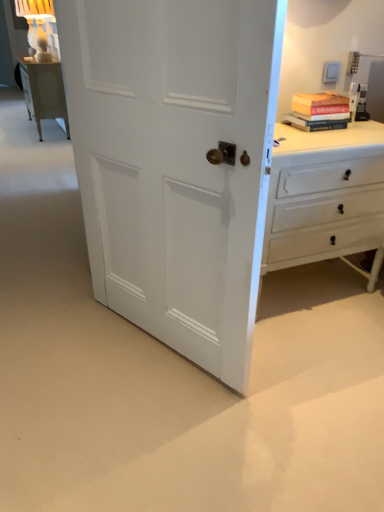
Question: From a real-world perspective, is hardcover book at upper right under white painted wood chest of drawers at right?

Choices:
 (A) yes
 (B) no

Answer: (B)

Question: Is hardcover book at upper right to the right of white painted wood chest of drawers at right from the viewer's perspective?

Choices:
 (A) no
 (B) yes

Answer: (B)

Question: Are hardcover book at upper right and white painted wood chest of drawers at right far apart?

Choices:
 (A) no
 (B) yes

Answer: (A)

Question: From the image's perspective, would you say hardcover book at upper right is shown under white painted wood chest of drawers at right?

Choices:
 (A) no
 (B) yes

Answer: (A)

Question: Are hardcover book at upper right and white painted wood chest of drawers at right making contact?

Choices:
 (A) no
 (B) yes

Answer: (A)

Question: Is hardcover book at upper right facing away from white painted wood chest of drawers at right?

Choices:
 (A) yes
 (B) no

Answer: (B)

Question: Does white painted wood door at center have a greater width compared to hardcover book at upper right?

Choices:
 (A) yes
 (B) no

Answer: (B)

Question: Can you confirm if white painted wood door at center is taller than hardcover book at upper right?

Choices:
 (A) yes
 (B) no

Answer: (A)

Question: From a real-world perspective, is white painted wood door at center on top of hardcover book at upper right?

Choices:
 (A) no
 (B) yes

Answer: (A)

Question: Is white painted wood door at center facing towards hardcover book at upper right?

Choices:
 (A) no
 (B) yes

Answer: (A)

Question: From the image's perspective, would you say white painted wood door at center is positioned over hardcover book at upper right?

Choices:
 (A) yes
 (B) no

Answer: (B)

Question: Is white painted wood door at center positioned in front of hardcover book at upper right?

Choices:
 (A) no
 (B) yes

Answer: (B)

Question: From a real-world perspective, is white painted wood chest of drawers at right located beneath white painted wood door at center?

Choices:
 (A) yes
 (B) no

Answer: (A)